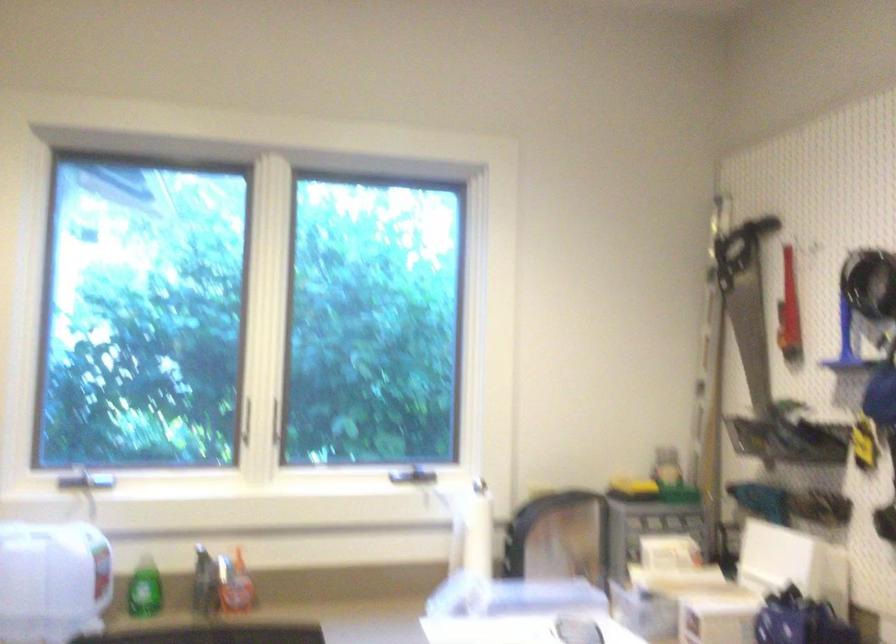
You are a GUI agent. You are given a task and a screenshot of the screen. Output one action in this format:
    pyautogui.click(x=<x>, y=<y>)
    Task: Click on the large saw handle
    
    Given the screenshot: What is the action you would take?
    pyautogui.click(x=745, y=232)